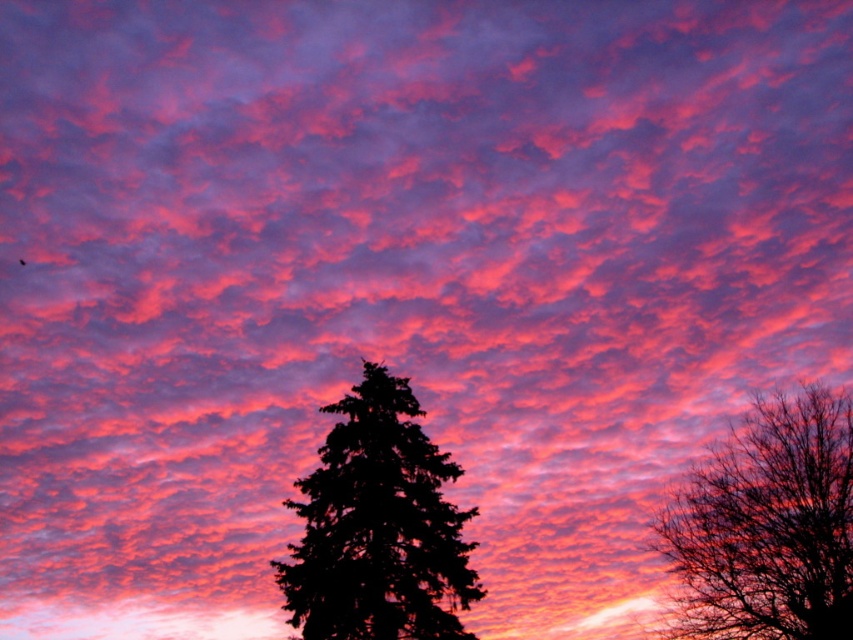
Question: Can you confirm if silhouette bare tree at center is positioned to the left of black textured tree at center?

Choices:
 (A) yes
 (B) no

Answer: (B)

Question: Is silhouette bare tree at center positioned at the back of black textured tree at center?

Choices:
 (A) no
 (B) yes

Answer: (B)

Question: Which object is farther from the camera taking this photo?

Choices:
 (A) black textured tree at center
 (B) silhouette bare tree at center

Answer: (B)

Question: Does silhouette bare tree at center have a greater width compared to black textured tree at center?

Choices:
 (A) yes
 (B) no

Answer: (A)